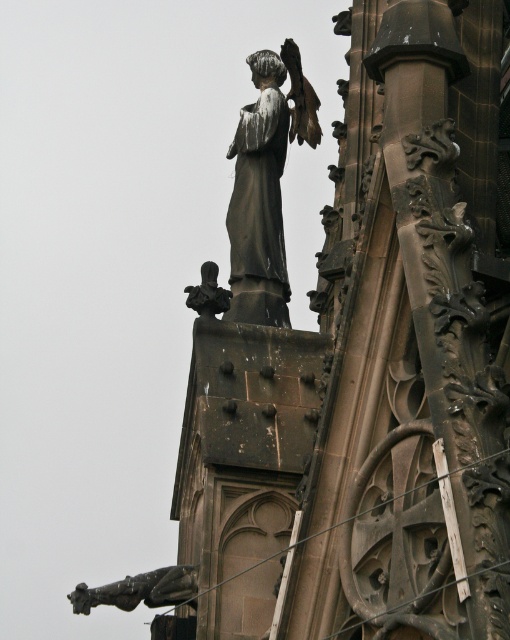
Question: Does dark brown stone statue at upper center have a smaller size compared to polished bronze statue at lower left?

Choices:
 (A) yes
 (B) no

Answer: (B)

Question: In this image, where is dark brown stone statue at upper center located relative to bronze statue at upper center?

Choices:
 (A) right
 (B) left

Answer: (A)

Question: Based on their relative distances, which object is nearer to the dark brown stone statue at upper center?

Choices:
 (A) bronze statue at upper center
 (B) polished bronze statue at lower left

Answer: (A)

Question: Is dark brown stone statue at upper center to the right of bronze statue at upper center from the viewer's perspective?

Choices:
 (A) no
 (B) yes

Answer: (B)

Question: Which of the following is the farthest from the observer?

Choices:
 (A) polished bronze statue at lower left
 (B) dark brown stone statue at upper center
 (C) bronze statue at upper center

Answer: (C)

Question: Which point is farther to the camera?

Choices:
 (A) (261, 88)
 (B) (279, 556)
 (C) (140, 592)

Answer: (A)